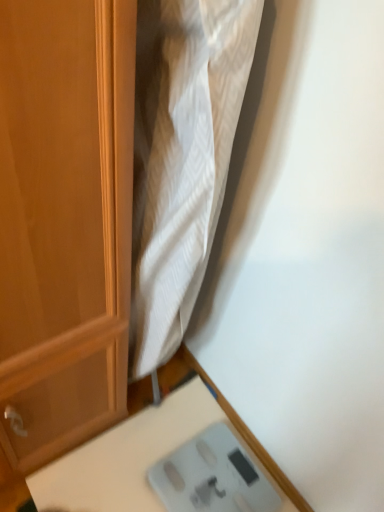
Question: Looking at their shapes, would you say white plastic scale at lower right is wider or thinner than gray plastic scale at lower right?

Choices:
 (A) thin
 (B) wide

Answer: (B)

Question: Based on their positions, is white plastic scale at lower right located to the left or right of gray plastic scale at lower right?

Choices:
 (A) left
 (B) right

Answer: (A)

Question: From their relative heights in the image, would you say white plastic scale at lower right is taller or shorter than gray plastic scale at lower right?

Choices:
 (A) short
 (B) tall

Answer: (B)

Question: Choose the correct answer: Is gray plastic scale at lower right inside white plastic scale at lower right or outside it?

Choices:
 (A) inside
 (B) outside

Answer: (A)

Question: In the image, is gray plastic scale at lower right positioned in front of or behind white plastic scale at lower right?

Choices:
 (A) behind
 (B) front

Answer: (A)

Question: Is gray plastic scale at lower right taller or shorter than white plastic scale at lower right?

Choices:
 (A) tall
 (B) short

Answer: (B)

Question: Is gray plastic scale at lower right wider or thinner than white plastic scale at lower right?

Choices:
 (A) wide
 (B) thin

Answer: (B)